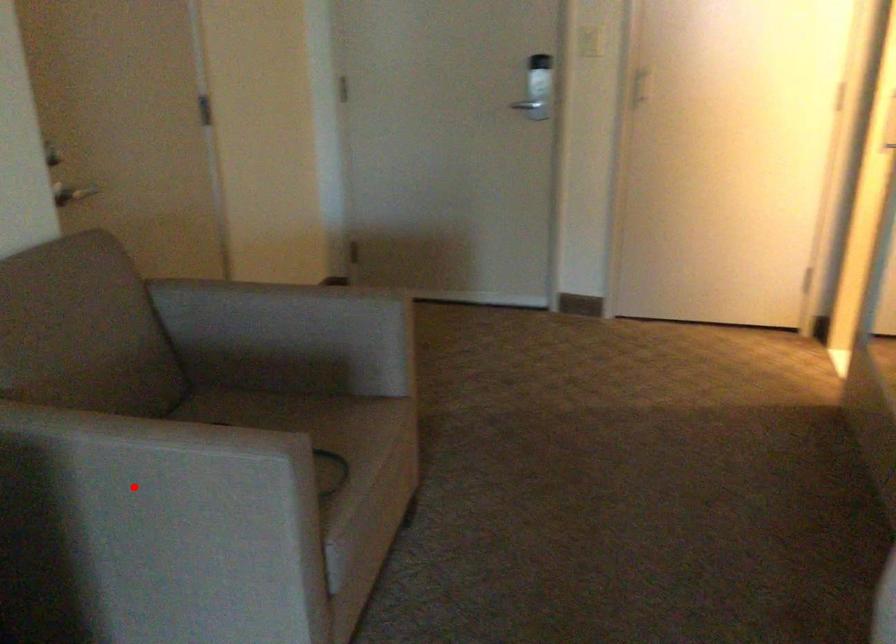
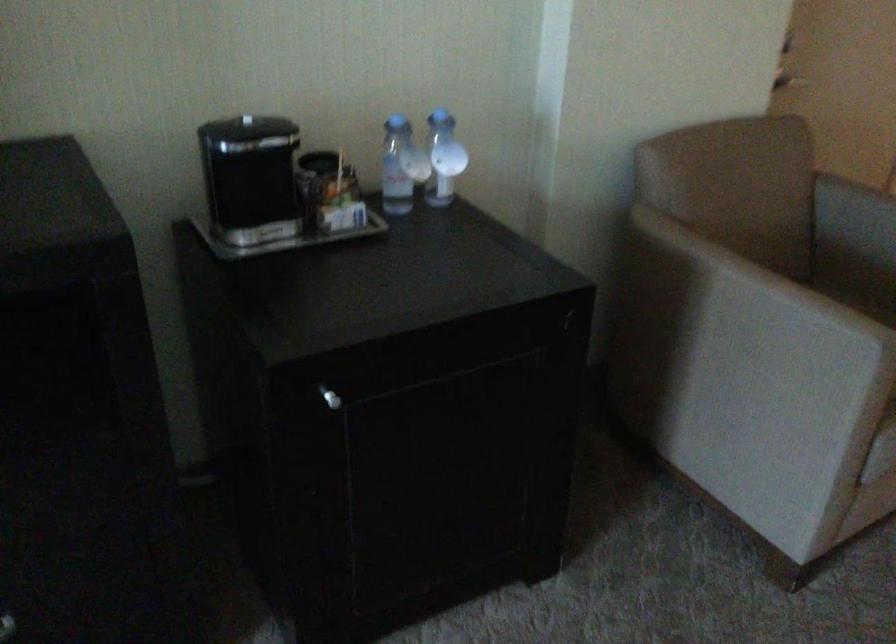
Question: I am providing you with two images of the same scene from different viewpoints. In image1, a red point is highlighted. Considering the same 3D point in image2, which of the following is correct?

Choices:
 (A) It is closer
 (B) It is farther

Answer: (B)